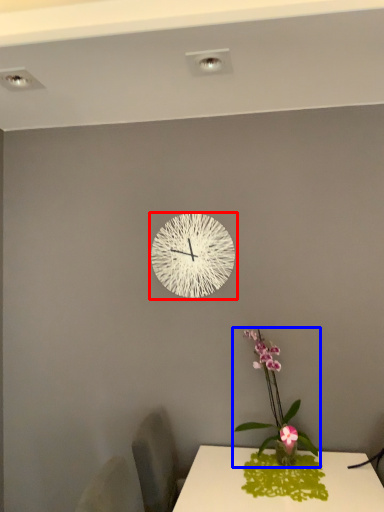
Question: Which point is further to the camera, wall clock (highlighted by a red box) or houseplant (highlighted by a blue box)?

Choices:
 (A) wall clock
 (B) houseplant

Answer: (A)